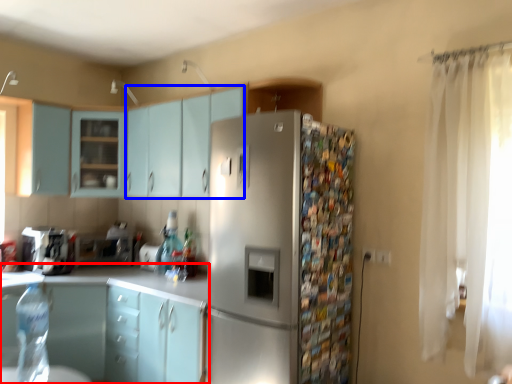
Question: Among these objects, which one is nearest to the camera, cabinetry (highlighted by a red box) or cabinetry (highlighted by a blue box)?

Choices:
 (A) cabinetry
 (B) cabinetry

Answer: (A)